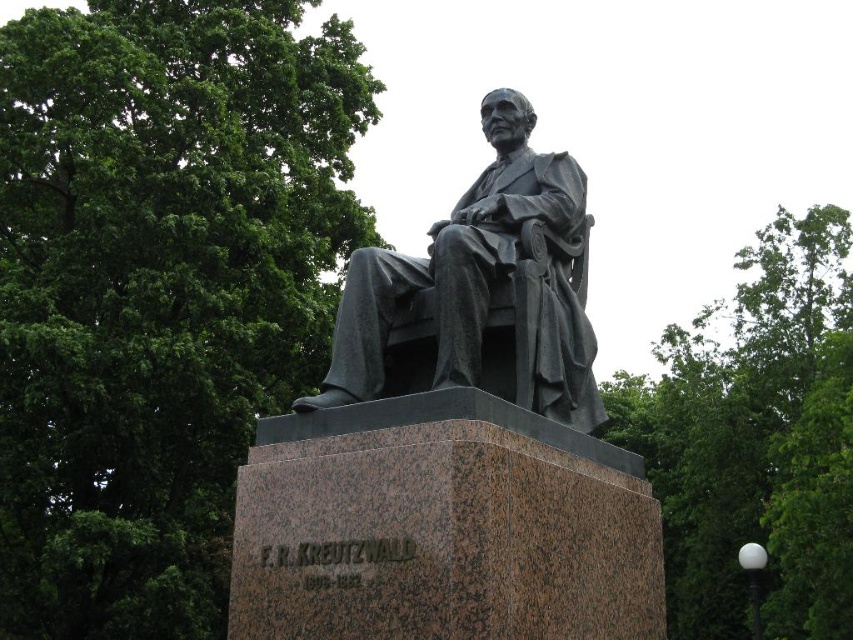
You are standing in front of the bronze statue at center and want to take a photo of it. To avoid having the green leafy tree at upper left in the background, which direction should you move relative to the statue?

The green leafy tree at upper left is to the left of the bronze statue at center. To avoid having it in the background, you should move to the right side of the bronze statue at center so that the tree is no longer behind you.

You are a landscape architect designing a garden around the statue. You need to place a new bench between the green leafy tree at upper left and the green leafy tree at upper right. Which tree should the bench be closer to for better shade, considering their sizes?

The green leafy tree at upper right is thicker, so the bench should be placed closer to it for better shade.

You are standing in front of the statue and notice a point marked at coordinates (158, 291). What object is located at that point?

The point at coordinates (158, 291) marks a green leafy tree at upper left.